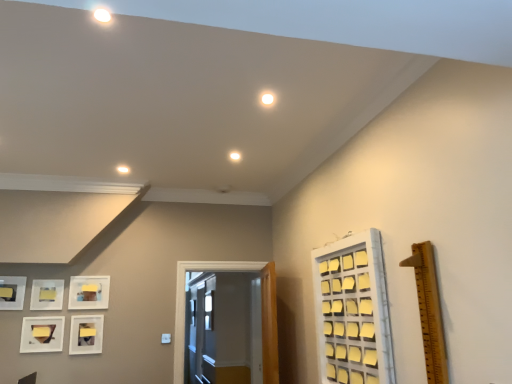
Locate an element on the screen. white glossy door at center is located at coordinates (184, 302).

Locate an element on the screen. matte white picture frame at left, arranged as the first picture frame when viewed from the left is located at coordinates click(x=12, y=292).

Measure the distance between matte white picture frame at lower left, which is counted as the 1th picture frame, starting from the right, and camera.

3.55 meters.

Where is `wooden ruler at right`? Image resolution: width=512 pixels, height=384 pixels. wooden ruler at right is located at coordinates (429, 311).

Which object is closer to the camera taking this photo, matte white picture frame at left, arranged as the first picture frame when viewed from the left, or wooden ruler at right?

wooden ruler at right is closer to the camera.

From the image's perspective, is matte white picture frame at left, which appears as the 5th picture frame when viewed from the right, under wooden ruler at right?

Yes.

Considering the relative sizes of matte white picture frame at left, which appears as the 5th picture frame when viewed from the right, and wooden ruler at right in the image provided, is matte white picture frame at left, which appears as the 5th picture frame when viewed from the right, shorter than wooden ruler at right?

Yes.

Considering the relative sizes of matte white picture frame at left, arranged as the first picture frame when viewed from the left, and wooden ruler at right in the image provided, is matte white picture frame at left, arranged as the first picture frame when viewed from the left, bigger than wooden ruler at right?

Answer: No.

Between matte white picture frame at lower left, which is counted as the 1th picture frame, starting from the right, and matte white picture frame at upper left, positioned as the fourth picture frame in right-to-left order, which one has less height?

matte white picture frame at upper left, positioned as the fourth picture frame in right-to-left order.

Which is in front, point (85, 328) or point (40, 302)?

The point (40, 302) is more forward.

From a real-world perspective, which picture frame is the 2nd one above the matte white picture frame at lower left, arranged as the 5th picture frame when viewed from the left? Please provide its 2D coordinates.

[(47, 294)]

Is matte white picture frame at lower left, which is counted as the 1th picture frame, starting from the right, beside matte white picture frame at upper left, positioned as the fourth picture frame in right-to-left order?

No, matte white picture frame at lower left, which is counted as the 1th picture frame, starting from the right, is not in contact with matte white picture frame at upper left, positioned as the fourth picture frame in right-to-left order.

From the image's perspective, who appears lower, white glossy door at center or wooden ruler at right?

From the image's view, white glossy door at center is below.

From a real-world perspective, which object stands above the other?

wooden ruler at right is physically above.

Between white glossy door at center and wooden ruler at right, which one appears on the left side from the viewer's perspective?

From the viewer's perspective, white glossy door at center appears more on the left side.

Who is taller, white matte picture frame at lower left, arranged as the fourth picture frame when viewed from the left, or matte white picture frame at lower left, the 3th picture frame from the left?

white matte picture frame at lower left, arranged as the fourth picture frame when viewed from the left.

From the image's perspective, is white matte picture frame at lower left, the 2th picture frame from the right, over matte white picture frame at lower left, acting as the third picture frame starting from the right?

Yes, from the image's perspective, white matte picture frame at lower left, the 2th picture frame from the right, is over matte white picture frame at lower left, acting as the third picture frame starting from the right.

Starting from the matte white picture frame at lower left, the 3th picture frame from the left, which picture frame is the 4th one behind? Please provide its 2D coordinates.

[(89, 292)]

From the picture: Which is more to the left, white matte picture frame at lower left, arranged as the fourth picture frame when viewed from the left, or matte white picture frame at lower left, the 3th picture frame from the left?

From the viewer's perspective, matte white picture frame at lower left, the 3th picture frame from the left, appears more on the left side.

Can we say white glossy door at center lies outside matte white picture frame at upper left, positioned as the fourth picture frame in right-to-left order?

Yes.

Between white glossy door at center and matte white picture frame at upper left, placed as the second picture frame when sorted from left to right, which one has smaller size?

matte white picture frame at upper left, placed as the second picture frame when sorted from left to right.

Does white glossy door at center come in front of matte white picture frame at upper left, positioned as the fourth picture frame in right-to-left order?

No, it is not.

Which point is more distant from viewer, (51, 282) or (237, 266)?

Positioned behind is point (237, 266).

Which object is thinner, matte white picture frame at upper left, positioned as the fourth picture frame in right-to-left order, or white glossy door at center?

matte white picture frame at upper left, positioned as the fourth picture frame in right-to-left order.

Which of these two, matte white picture frame at upper left, placed as the second picture frame when sorted from left to right, or white glossy door at center, is smaller?

matte white picture frame at upper left, placed as the second picture frame when sorted from left to right.

Is matte white picture frame at upper left, positioned as the fourth picture frame in right-to-left order, located outside white glossy door at center?

Yes, matte white picture frame at upper left, positioned as the fourth picture frame in right-to-left order, is located beyond the bounds of white glossy door at center.

Does matte white picture frame at lower left, acting as the third picture frame starting from the right, have a smaller size compared to wooden ruler at right?

Correct, matte white picture frame at lower left, acting as the third picture frame starting from the right, occupies less space than wooden ruler at right.

Can wooden ruler at right be found inside matte white picture frame at lower left, acting as the third picture frame starting from the right?

Actually, wooden ruler at right is outside matte white picture frame at lower left, acting as the third picture frame starting from the right.

From a real-world perspective, which is physically above, matte white picture frame at lower left, acting as the third picture frame starting from the right, or wooden ruler at right?

wooden ruler at right, from a real-world perspective.

Looking at this image, measure the distance from matte white picture frame at lower left, the 3th picture frame from the left, to wooden ruler at right.

matte white picture frame at lower left, the 3th picture frame from the left, and wooden ruler at right are 3.01 meters apart.

At what (x,y) coordinates should I click in order to perform the action: click on ruler above the matte white picture frame at left, arranged as the first picture frame when viewed from the left (from the image's perspective). Please return your answer as a coordinate pair (x, y). Looking at the image, I should click on (429, 311).

I want to click on the 3rd picture frame counting from the left of the matte white picture frame at lower left, which is counted as the 1th picture frame, starting from the right, so (47, 294).

Based on their spatial positions, is wooden ruler at right or white glossy door at center further from matte white picture frame at upper left, positioned as the fourth picture frame in right-to-left order?

The object further to matte white picture frame at upper left, positioned as the fourth picture frame in right-to-left order, is wooden ruler at right.

Considering their positions, is matte white picture frame at upper left, placed as the second picture frame when sorted from left to right, positioned closer to white matte picture frame at lower left, the 2th picture frame from the right, than white glossy door at center?

The object closer to white matte picture frame at lower left, the 2th picture frame from the right, is matte white picture frame at upper left, placed as the second picture frame when sorted from left to right.

From the image, which object appears to be nearer to matte white picture frame at lower left, arranged as the 5th picture frame when viewed from the left, white matte picture frame at lower left, the 2th picture frame from the right, or matte white picture frame at left, which appears as the 5th picture frame when viewed from the right?

white matte picture frame at lower left, the 2th picture frame from the right.

Considering their positions, is white matte picture frame at lower left, arranged as the fourth picture frame when viewed from the left, positioned closer to matte white picture frame at lower left, the 3th picture frame from the left, than matte white picture frame at left, which appears as the 5th picture frame when viewed from the right?

matte white picture frame at left, which appears as the 5th picture frame when viewed from the right, lies closer to matte white picture frame at lower left, the 3th picture frame from the left, than the other object.

Based on the photo, based on their spatial positions, is white glossy door at center or white matte picture frame at lower left, the 2th picture frame from the right, further from matte white picture frame at lower left, arranged as the 5th picture frame when viewed from the left?

white glossy door at center.

Based on their spatial positions, is wooden ruler at right or matte white picture frame at upper left, placed as the second picture frame when sorted from left to right, closer to matte white picture frame at lower left, which is counted as the 1th picture frame, starting from the right?

The object closer to matte white picture frame at lower left, which is counted as the 1th picture frame, starting from the right, is matte white picture frame at upper left, placed as the second picture frame when sorted from left to right.

Looking at the image, which one is located closer to wooden ruler at right, white glossy door at center or matte white picture frame at upper left, placed as the second picture frame when sorted from left to right?

Based on the image, white glossy door at center appears to be nearer to wooden ruler at right.

Based on their spatial positions, is wooden ruler at right or matte white picture frame at left, arranged as the first picture frame when viewed from the left, closer to white glossy door at center?

The object closer to white glossy door at center is matte white picture frame at left, arranged as the first picture frame when viewed from the left.

Where is `picture frame between matte white picture frame at upper left, positioned as the fourth picture frame in right-to-left order, and white matte picture frame at lower left, arranged as the fourth picture frame when viewed from the left`? picture frame between matte white picture frame at upper left, positioned as the fourth picture frame in right-to-left order, and white matte picture frame at lower left, arranged as the fourth picture frame when viewed from the left is located at coordinates (42, 334).

Where is `picture frame between white matte picture frame at lower left, arranged as the fourth picture frame when viewed from the left, and wooden ruler at right, in the horizontal direction`? picture frame between white matte picture frame at lower left, arranged as the fourth picture frame when viewed from the left, and wooden ruler at right, in the horizontal direction is located at coordinates (86, 334).

The image size is (512, 384). I want to click on door between matte white picture frame at lower left, acting as the third picture frame starting from the right, and wooden ruler at right, so click(184, 302).

At what (x,y) coordinates should I click in order to perform the action: click on picture frame between matte white picture frame at left, which appears as the 5th picture frame when viewed from the right, and matte white picture frame at lower left, the 3th picture frame from the left, from left to right. Please return your answer as a coordinate pair (x, y). This screenshot has width=512, height=384. Looking at the image, I should click on (47, 294).